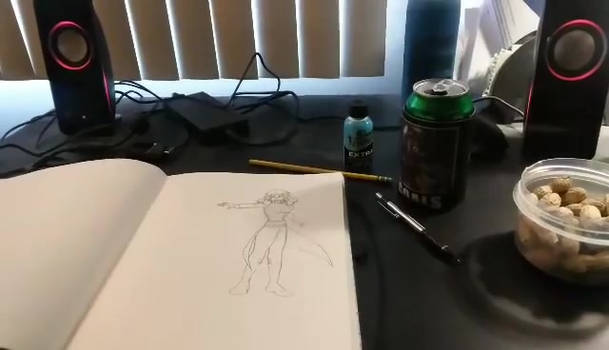
Locate an element on the screen. individual slats of blinds is located at coordinates pos(356,38), pos(318,28), pos(279,27), pos(231,24), pos(181,19), pos(148,24), pos(113,20), pos(7,42), pos(30,31).